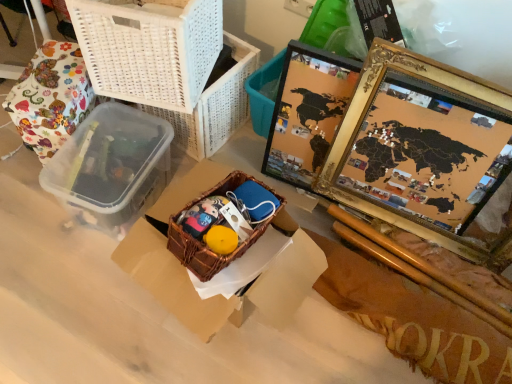
At what (x,y) coordinates should I click in order to perform the action: click on free space in front of floral fabric wrapped object at left. Please return your answer as a coordinate pair (x, y). The height and width of the screenshot is (384, 512). Looking at the image, I should click on [x=34, y=206].